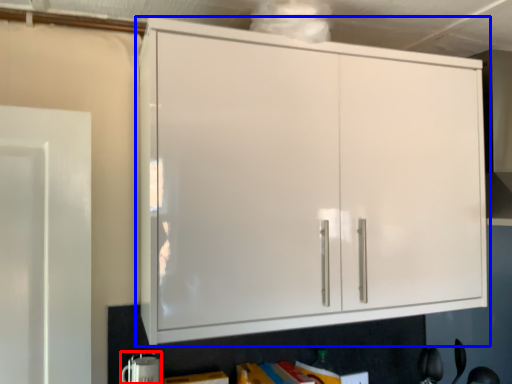
Question: Which object is closer to the camera taking this photo, appliance (highlighted by a red box) or cupboard (highlighted by a blue box)?

Choices:
 (A) appliance
 (B) cupboard

Answer: (B)